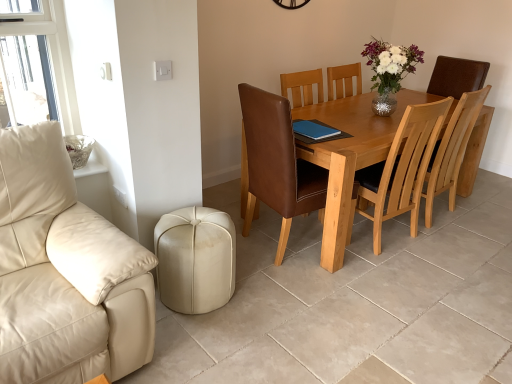
Where is `free spot above beige leather ottoman at lower left (from a real-world perspective)`? This screenshot has height=384, width=512. free spot above beige leather ottoman at lower left (from a real-world perspective) is located at coordinates pyautogui.click(x=195, y=221).